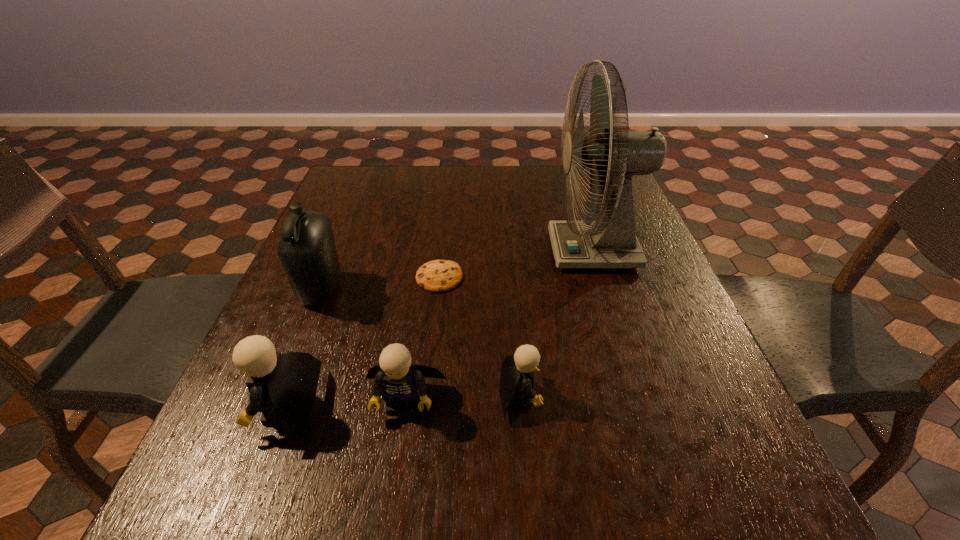
Locate an element on the screen. free point between the shortest object and the bottle is located at coordinates (380, 284).

Where is `free spot between the shortest object and the leftmost Lego`? This screenshot has height=540, width=960. free spot between the shortest object and the leftmost Lego is located at coordinates (363, 343).

Where is `vacant area that lies between the fan and the shortest object`? The height and width of the screenshot is (540, 960). vacant area that lies between the fan and the shortest object is located at coordinates click(x=516, y=264).

Where is `free space between the shortest object and the leftmost Lego`? This screenshot has width=960, height=540. free space between the shortest object and the leftmost Lego is located at coordinates (363, 343).

The image size is (960, 540). Find the location of `object identified as the fourth closest to the second tallest object`. object identified as the fourth closest to the second tallest object is located at coordinates (518, 370).

Choose which object is the second nearest neighbor to the shortest object. Please provide its 2D coordinates. Your answer should be formatted as a tuple, i.e. [(x, y)], where the tuple contains the x and y coordinates of a point satisfying the conditions above.

[(518, 370)]

Locate which Lego is the third closest to the rightmost object. Please provide its 2D coordinates. Your answer should be formatted as a tuple, i.e. [(x, y)], where the tuple contains the x and y coordinates of a point satisfying the conditions above.

[(283, 387)]

Locate which Lego ranks second in proximity to the second tallest object. Please provide its 2D coordinates. Your answer should be formatted as a tuple, i.e. [(x, y)], where the tuple contains the x and y coordinates of a point satisfying the conditions above.

[(399, 380)]

Locate an element on the screen. The height and width of the screenshot is (540, 960). vacant area that satisfies the following two spatial constraints: 1. on the front-facing side of the rightmost Lego; 2. on the front-facing side of the second shortest Lego is located at coordinates (520, 401).

Where is `free location that satisfies the following two spatial constraints: 1. on the front-facing side of the fourth tallest object; 2. on the front-facing side of the leftmost Lego`? The image size is (960, 540). free location that satisfies the following two spatial constraints: 1. on the front-facing side of the fourth tallest object; 2. on the front-facing side of the leftmost Lego is located at coordinates (404, 408).